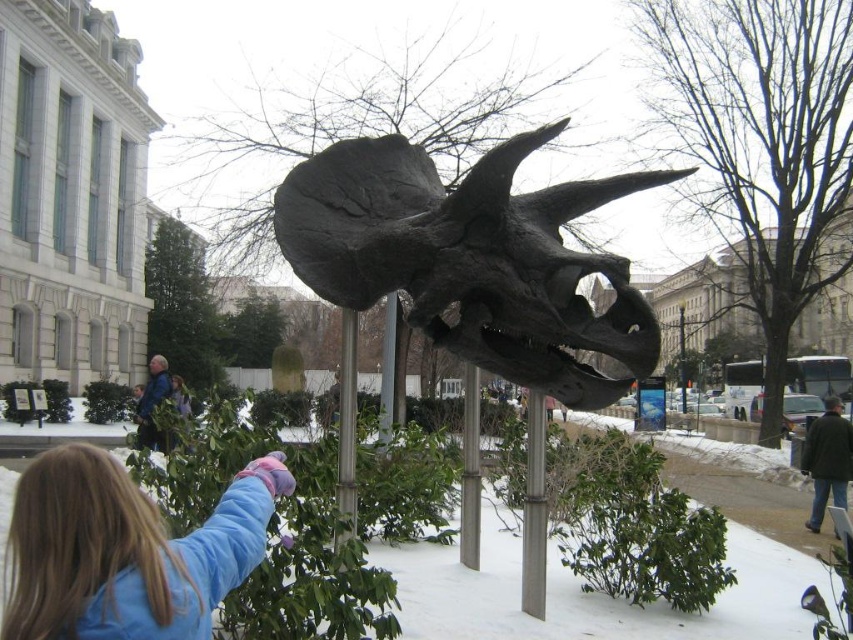
You are a GUI agent. You are given a task and a screenshot of the screen. Output one action in this format:
    pyautogui.click(x=<x>, y=<y>)
    Task: Click on the metallic gray pole at center
    
    Given the screenshot: What is the action you would take?
    pyautogui.click(x=534, y=509)

Does metallic gray pole at center have a smaller size compared to metallic silver pole at center?

Indeed, metallic gray pole at center has a smaller size compared to metallic silver pole at center.

Describe the element at coordinates (534, 509) in the screenshot. I see `metallic gray pole at center` at that location.

Locate an element on the screen. The height and width of the screenshot is (640, 853). metallic gray pole at center is located at coordinates 534,509.

Consider the image. Which of these two, dark gray metallic skull at center or metallic silver pole at center, stands shorter?

metallic silver pole at center is shorter.

Is dark gray metallic skull at center smaller than metallic silver pole at center?

No.

Does point (410, 285) come farther from viewer compared to point (346, 540)?

Yes, point (410, 285) is farther from viewer.

The image size is (853, 640). I want to click on dark gray metallic skull at center, so click(471, 259).

You are a GUI agent. You are given a task and a screenshot of the screen. Output one action in this format:
    pyautogui.click(x=<x>, y=<y>)
    Task: Click on the metallic silver pole at center
    This screenshot has height=640, width=853.
    Given the screenshot: What is the action you would take?
    pyautogui.click(x=346, y=429)

Consider the image. Between metallic silver pole at center and gray metallic pole at center, which one is positioned lower?

metallic silver pole at center

Between point (339, 515) and point (383, 442), which one is positioned in front?

Point (339, 515)

Image resolution: width=853 pixels, height=640 pixels. In order to click on metallic silver pole at center in this screenshot , I will do `click(346, 429)`.